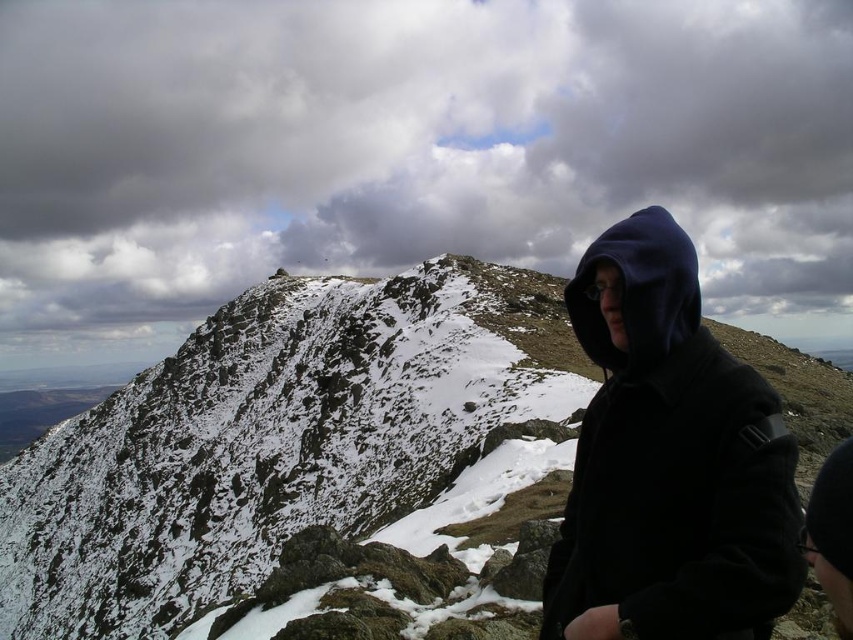
Question: Can you confirm if matte black hoodie at right is positioned above navy blue hoodie at right?

Choices:
 (A) yes
 (B) no

Answer: (B)

Question: Among these points, which one is nearest to the camera?

Choices:
 (A) (581, 257)
 (B) (4, 612)
 (C) (560, 557)

Answer: (C)

Question: Which point is farther from the camera taking this photo?

Choices:
 (A) (642, 268)
 (B) (810, 440)
 (C) (592, 573)

Answer: (B)

Question: Which object appears farthest from the camera in this image?

Choices:
 (A) navy blue hoodie at right
 (B) matte black hoodie at right

Answer: (A)

Question: Does matte black hoodie at right come in front of navy blue hoodie at right?

Choices:
 (A) no
 (B) yes

Answer: (B)

Question: Does snowy rocky mountain at upper center appear under navy blue hoodie at right?

Choices:
 (A) yes
 (B) no

Answer: (A)